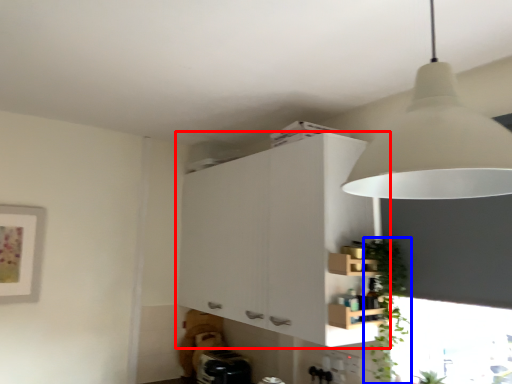
Question: Which object appears farthest to the camera in this image, cabinetry (highlighted by a red box) or plant (highlighted by a blue box)?

Choices:
 (A) cabinetry
 (B) plant

Answer: (A)